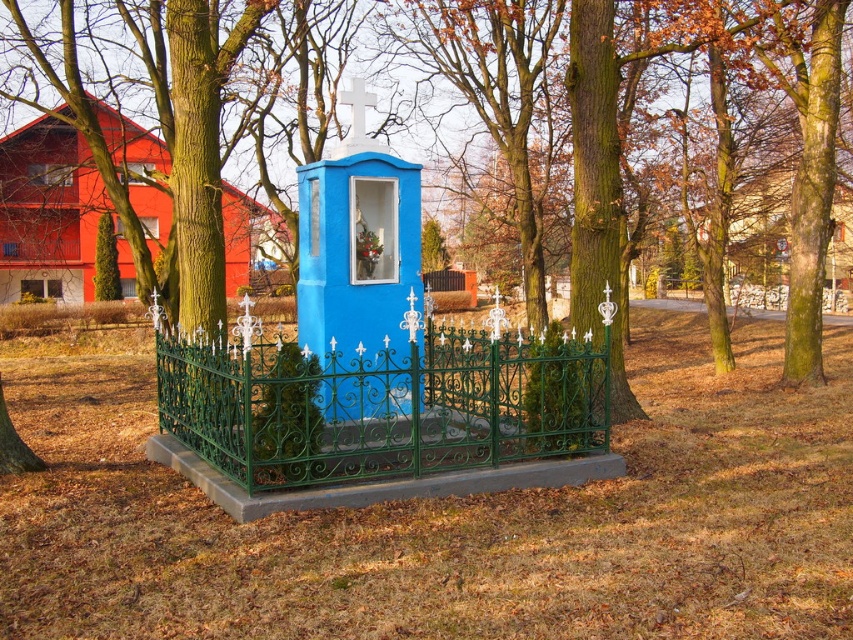
Which is below, green textured fence at center or green wrought iron fence at center?

green wrought iron fence at center is below.

Is green textured fence at center further to the viewer compared to green wrought iron fence at center?

Yes, it is.

This screenshot has width=853, height=640. In order to click on green textured fence at center in this screenshot , I will do `click(746, 83)`.

The height and width of the screenshot is (640, 853). Identify the location of green textured fence at center. (746, 83).

Is green textured fence at center closer to the viewer compared to blue painted wood gazebo at center?

No, green textured fence at center is further to the viewer.

Who is more distant from viewer, (123, 77) or (339, 294)?

The point (123, 77) is behind.

Between point (578, 308) and point (335, 275), which one is positioned in front?

Point (335, 275)

Locate an element on the screen. The image size is (853, 640). green textured fence at center is located at coordinates (746, 83).

Who is taller, green wrought iron fence at center or blue painted wood gazebo at center?

Standing taller between the two is blue painted wood gazebo at center.

Does green wrought iron fence at center have a larger size compared to blue painted wood gazebo at center?

No, green wrought iron fence at center is not bigger than blue painted wood gazebo at center.

Locate an element on the screen. This screenshot has width=853, height=640. green wrought iron fence at center is located at coordinates (379, 401).